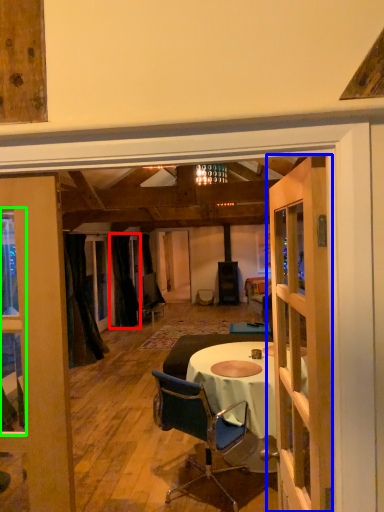
Question: Considering the real-world distances, which object is closest to curtain (highlighted by a red box)? door (highlighted by a blue box) or window (highlighted by a green box).

Choices:
 (A) door
 (B) window

Answer: (B)